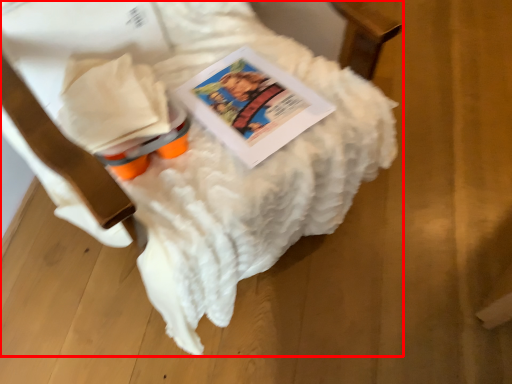
Question: Considering the relative positions of furniture (annotated by the red box) and book in the image provided, where is furniture (annotated by the red box) located with respect to the staircase?

Choices:
 (A) right
 (B) left

Answer: (B)